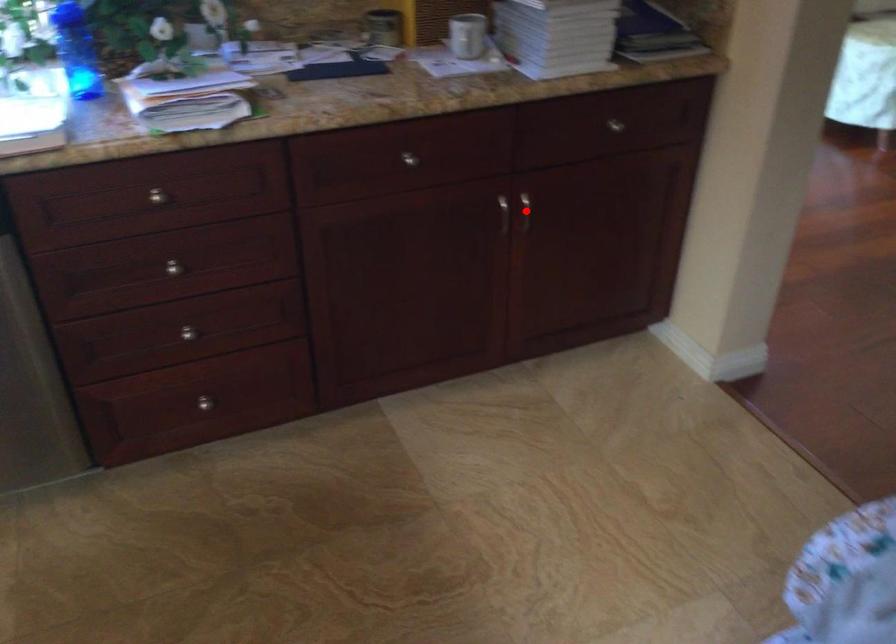
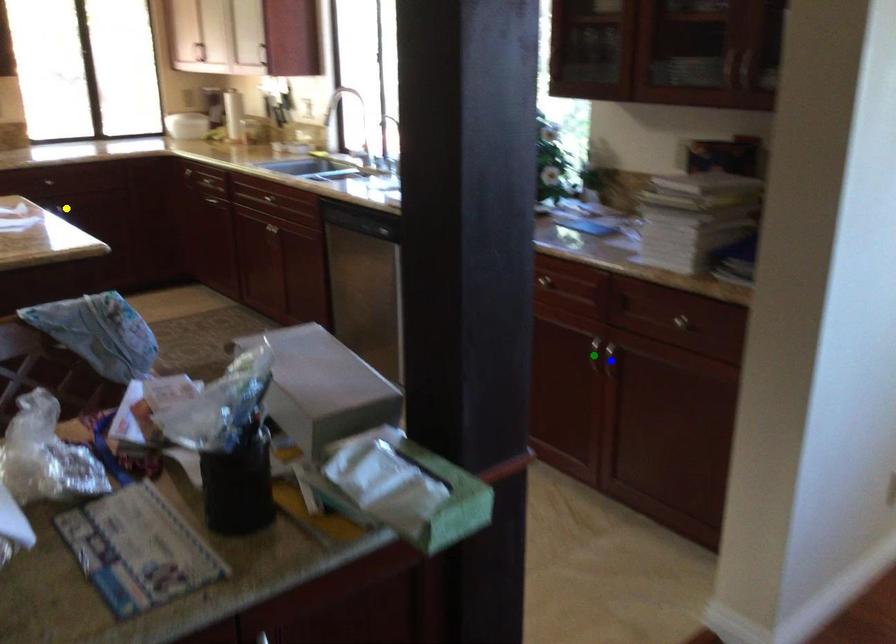
Question: I am providing you with two images of the same scene from different viewpoints. A red point is marked on the first image. You are given multiple points on the second image. Which point in image 2 represents the same 3d spot as the red point in image 1?

Choices:
 (A) yellow point
 (B) green point
 (C) blue point

Answer: (C)